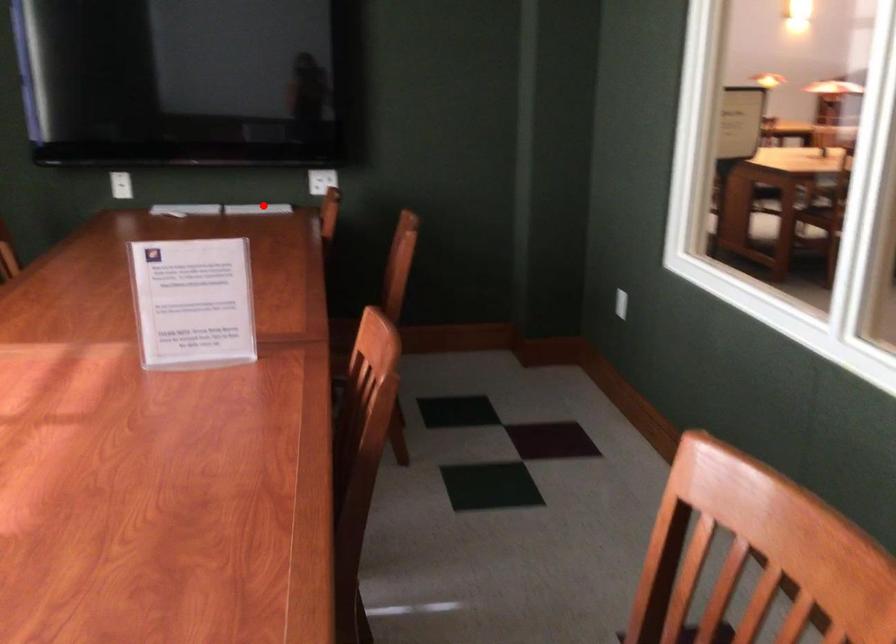
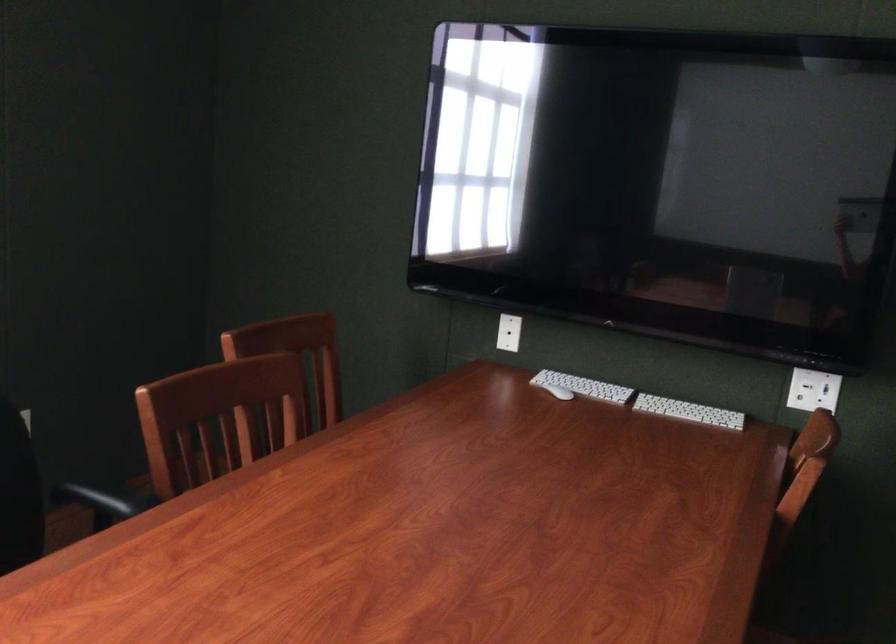
Find the pixel in the second image that matches the highlighted location in the first image.

(688, 412)